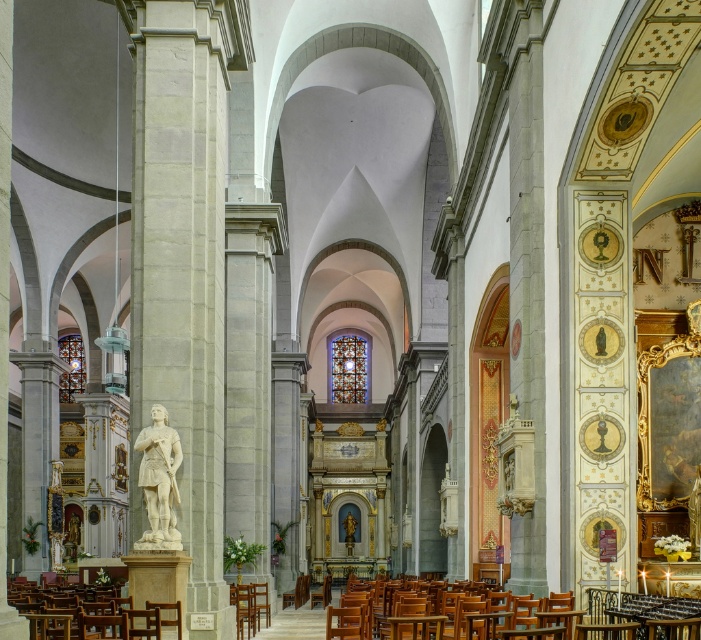
Question: Is white marble statue at center to the left of wooden polished chair at lower left from the viewer's perspective?

Choices:
 (A) no
 (B) yes

Answer: (A)

Question: Does white marble statue at left appear over wooden polished chair at center?

Choices:
 (A) no
 (B) yes

Answer: (B)

Question: Among these points, which one is farthest from the camera?

Choices:
 (A) (130, 333)
 (B) (360, 588)
 (C) (61, 604)

Answer: (A)

Question: Where is white marble statue at left located in relation to wooden polished chair at lower left in the image?

Choices:
 (A) right
 (B) left

Answer: (A)

Question: Which of these objects is positioned closest to the white marble statue at left?

Choices:
 (A) wooden polished chair at lower left
 (B) white marble statue at center
 (C) wooden polished chair at center

Answer: (B)

Question: Which of the following is the closest to the observer?

Choices:
 (A) white marble statue at left
 (B) wooden polished chair at lower left

Answer: (B)